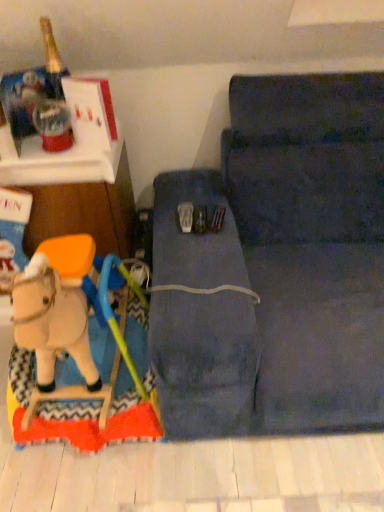
Question: Considering the relative sizes of wooden matte horse at lower left and wooden rocking horse at left in the image provided, is wooden matte horse at lower left shorter than wooden rocking horse at left?

Choices:
 (A) yes
 (B) no

Answer: (A)

Question: Can you confirm if wooden matte horse at lower left is wider than wooden rocking horse at left?

Choices:
 (A) yes
 (B) no

Answer: (B)

Question: Is wooden rocking horse at left surrounded by wooden matte horse at lower left?

Choices:
 (A) yes
 (B) no

Answer: (B)

Question: From a real-world perspective, is wooden matte horse at lower left located higher than wooden rocking horse at left?

Choices:
 (A) yes
 (B) no

Answer: (B)

Question: From the image's perspective, does wooden matte horse at lower left appear higher than wooden rocking horse at left?

Choices:
 (A) no
 (B) yes

Answer: (A)

Question: Could you tell me if wooden matte horse at lower left is facing wooden rocking horse at left?

Choices:
 (A) yes
 (B) no

Answer: (B)

Question: From the image's perspective, is wooden matte horse at lower left above dark blue fabric studio couch at center?

Choices:
 (A) yes
 (B) no

Answer: (B)

Question: Can you confirm if wooden matte horse at lower left is taller than dark blue fabric studio couch at center?

Choices:
 (A) yes
 (B) no

Answer: (B)

Question: Can you confirm if wooden matte horse at lower left is smaller than dark blue fabric studio couch at center?

Choices:
 (A) no
 (B) yes

Answer: (B)

Question: Is wooden matte horse at lower left positioned in front of dark blue fabric studio couch at center?

Choices:
 (A) yes
 (B) no

Answer: (B)

Question: Is dark blue fabric studio couch at center surrounded by wooden matte horse at lower left?

Choices:
 (A) no
 (B) yes

Answer: (A)

Question: Does wooden matte horse at lower left have a larger size compared to dark blue fabric studio couch at center?

Choices:
 (A) no
 (B) yes

Answer: (A)

Question: Can you confirm if dark blue fabric studio couch at center is positioned to the left of wooden matte horse at lower left?

Choices:
 (A) no
 (B) yes

Answer: (A)